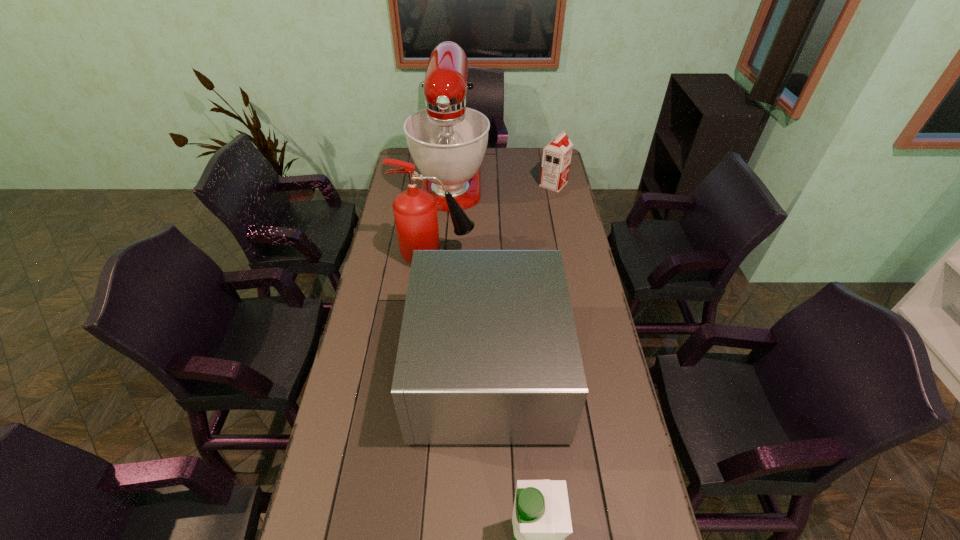
You are a GUI agent. You are given a task and a screenshot of the screen. Output one action in this format:
    pyautogui.click(x=<x>, y=<y>)
    Task: Click on the mixer
    This screenshot has height=540, width=960.
    Given the screenshot: What is the action you would take?
    447,140

Find the location of a particular element. The width and height of the screenshot is (960, 540). the fourth shortest object is located at coordinates (415, 210).

Find the location of a particular element. This screenshot has height=540, width=960. the third nearest object is located at coordinates (415, 210).

You are a GUI agent. You are given a task and a screenshot of the screen. Output one action in this format:
    pyautogui.click(x=<x>, y=<y>)
    Task: Click on the second nearest object
    The height and width of the screenshot is (540, 960).
    Given the screenshot: What is the action you would take?
    pyautogui.click(x=488, y=353)

Where is `the right soya milk`? This screenshot has height=540, width=960. the right soya milk is located at coordinates (556, 159).

Where is `the rightmost object`? the rightmost object is located at coordinates (556, 159).

Find the location of a particular element. vacant region located 0.120m at the attachment hub of the tallest object is located at coordinates (447, 233).

At what (x,y) coordinates should I click in order to perform the action: click on free space located 0.160m with the nozzle aimed from the third farthest object. Please return your answer as a coordinate pair (x, y). This screenshot has height=540, width=960. Looking at the image, I should click on (516, 256).

This screenshot has width=960, height=540. What are the coordinates of `vacant space located 0.100m with the door open on the second nearest object` in the screenshot? It's located at (378, 369).

Find the location of a particular element. free location located 0.180m with the door open on the second nearest object is located at coordinates (352, 369).